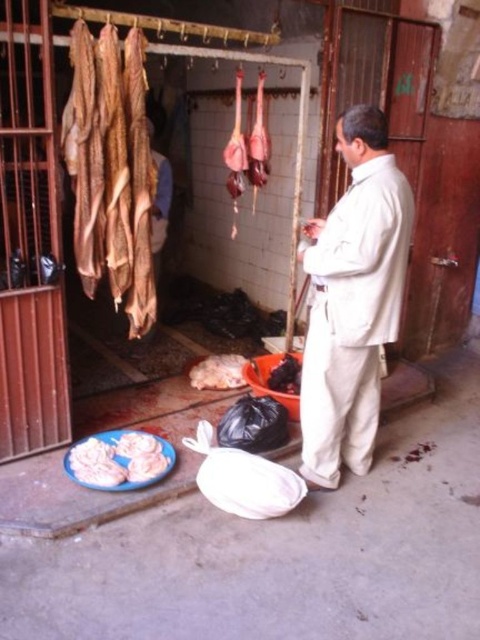
Question: Which is farther from the white fluffy bread at lower left?

Choices:
 (A) black glossy meat at center
 (B) light beige suit at center
 (C) white soft meat at center
 (D) brown leather hides at upper left

Answer: (B)

Question: Is light beige suit at center thinner than brown leather hides at upper left?

Choices:
 (A) yes
 (B) no

Answer: (B)

Question: Which object is closer to the camera taking this photo?

Choices:
 (A) light beige suit at center
 (B) white soft meat at center
 (C) brown leather hides at upper left

Answer: (A)

Question: Does brown leather hides at upper left appear on the left side of white fluffy bread at lower left?

Choices:
 (A) yes
 (B) no

Answer: (A)

Question: Which object is positioned farthest from the white fluffy bread at lower left?

Choices:
 (A) brown leather hides at upper left
 (B) black glossy meat at center

Answer: (A)

Question: Can you confirm if white fluffy bread at lower left is positioned below black glossy meat at center?

Choices:
 (A) yes
 (B) no

Answer: (A)